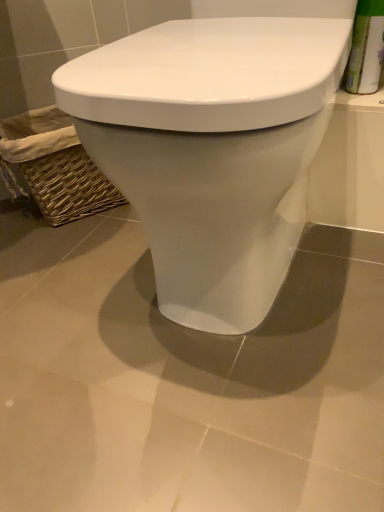
What are the coordinates of `free space in front of white glossy toilet at center` in the screenshot? It's located at (262, 398).